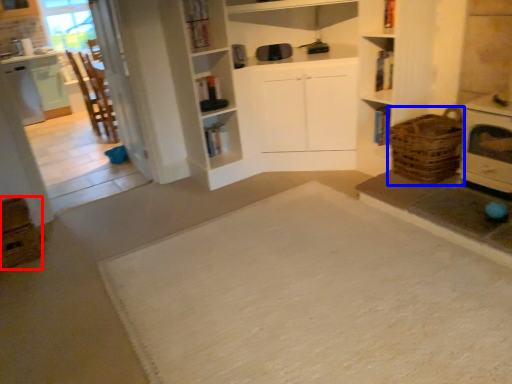
Question: Which point is further to the camera, crate (highlighted by a red box) or basket (highlighted by a blue box)?

Choices:
 (A) crate
 (B) basket

Answer: (B)